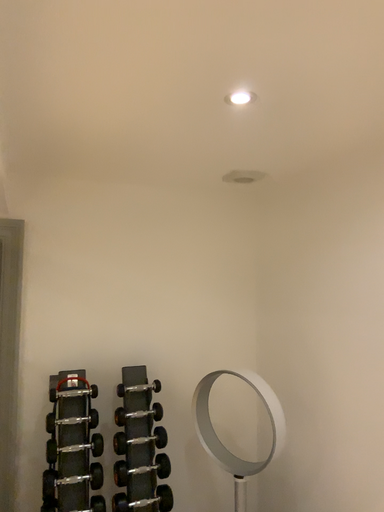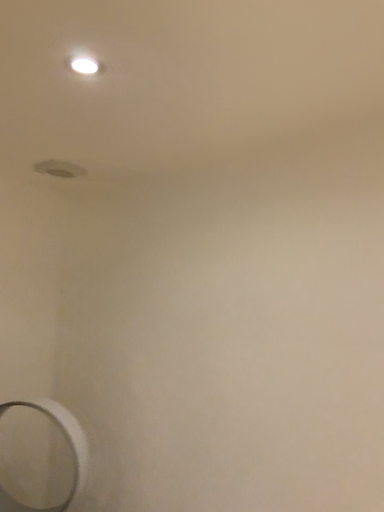
Question: Which way did the camera rotate in the video?

Choices:
 (A) rotated right
 (B) rotated left

Answer: (A)